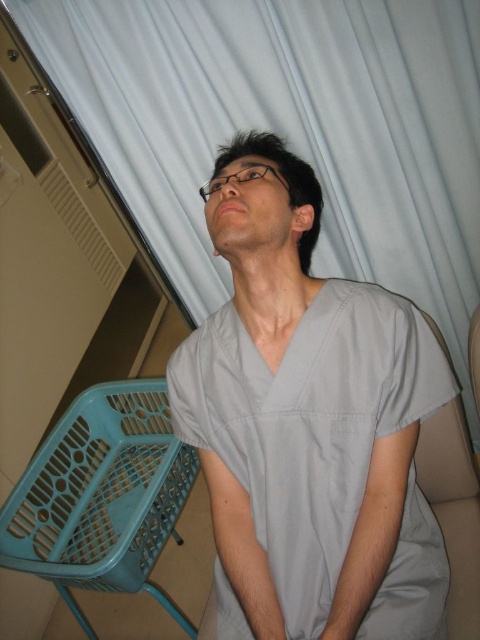
Who is higher up, gray matte scrubs at center or beige fabric chair at lower right?

Positioned higher is gray matte scrubs at center.

Does gray matte scrubs at center come in front of beige fabric chair at lower right?

Yes, it is in front of beige fabric chair at lower right.

Which is behind, point (448, 371) or point (451, 620)?

The point (448, 371) is behind.

At what (x,y) coordinates should I click in order to perform the action: click on gray matte scrubs at center. Please return your answer as a coordinate pair (x, y). Looking at the image, I should click on (308, 422).

Is the position of white fabric curtain at upper center more distant than that of beige fabric chair at lower right?

Yes, white fabric curtain at upper center is behind beige fabric chair at lower right.

Is white fabric curtain at upper center shorter than beige fabric chair at lower right?

Incorrect, white fabric curtain at upper center's height does not fall short of beige fabric chair at lower right's.

Who is more distant from viewer, (299, 52) or (454, 625)?

The point (299, 52) is behind.

I want to click on white fabric curtain at upper center, so click(289, 129).

In the scene shown: Which of these two, white fabric curtain at upper center or gray matte scrubs at center, stands shorter?

With less height is gray matte scrubs at center.

Between point (141, 67) and point (380, 404), which one is positioned behind?

Positioned behind is point (141, 67).

The image size is (480, 640). Find the location of `white fabric curtain at upper center`. white fabric curtain at upper center is located at coordinates (289, 129).